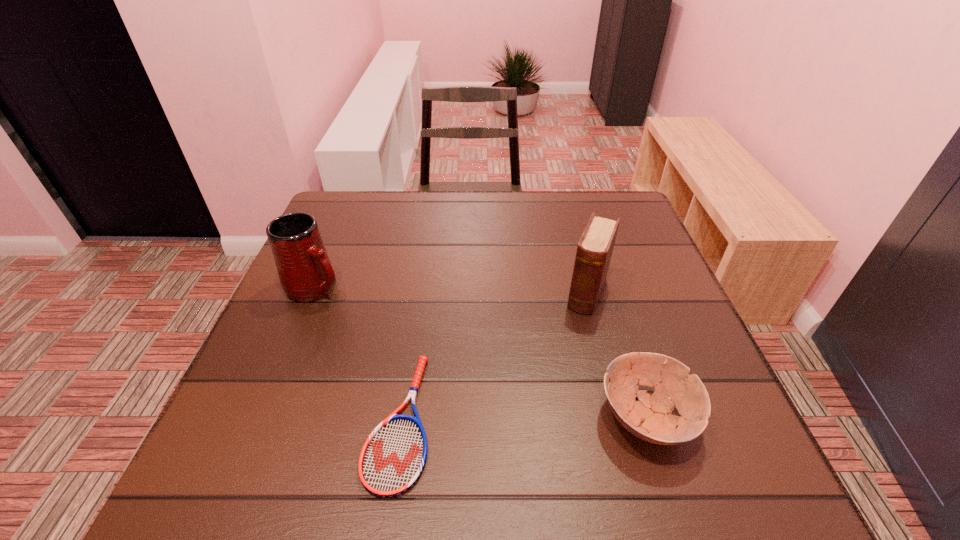
Find the location of a particular element. vacant spot on the desktop that is between the third object from right to left and the second shortest object and is positioned on the spine side of the diary is located at coordinates [538, 418].

At what (x,y) coordinates should I click in order to perform the action: click on vacant spot on the desktop that is between the shortest object and the second shortest object and is positioned on the side of the mug with the handle. Please return your answer as a coordinate pair (x, y). The height and width of the screenshot is (540, 960). Looking at the image, I should click on (544, 418).